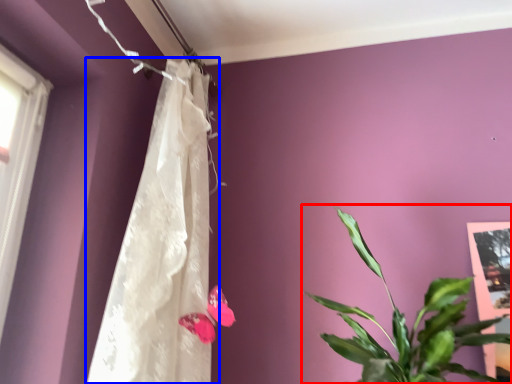
Question: Which object appears closest to the camera in this image, houseplant (highlighted by a red box) or curtain (highlighted by a blue box)?

Choices:
 (A) houseplant
 (B) curtain

Answer: (A)